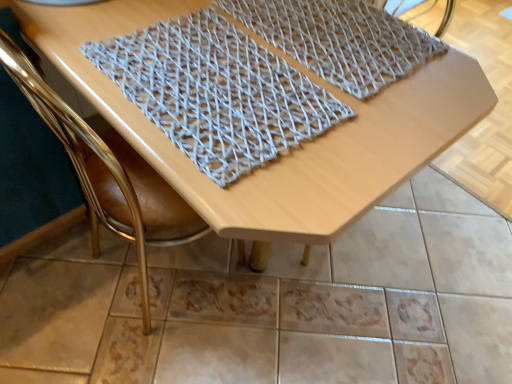
Question: Considering the positions of knitted fabric at center, placed as the 1th blanket when sorted from left to right, and wooden table at center in the image, is knitted fabric at center, placed as the 1th blanket when sorted from left to right, wider or thinner than wooden table at center?

Choices:
 (A) thin
 (B) wide

Answer: (A)

Question: Is knitted fabric at center, placed as the 1th blanket when sorted from left to right, spatially inside wooden table at center, or outside of it?

Choices:
 (A) outside
 (B) inside

Answer: (B)

Question: Which of these objects is positioned farthest from the gray woven mat at upper center, acting as the 1th blanket starting from the right?

Choices:
 (A) gold leather chair at upper left
 (B) knitted fabric at center, which ranks as the 2th blanket in right-to-left order
 (C) wooden table at center

Answer: (A)

Question: Estimate the real-world distances between objects in this image. Which object is closer to the gray woven mat at upper center, acting as the 1th blanket starting from the right?

Choices:
 (A) gold leather chair at upper left
 (B) wooden table at center
 (C) knitted fabric at center, placed as the 1th blanket when sorted from left to right

Answer: (B)